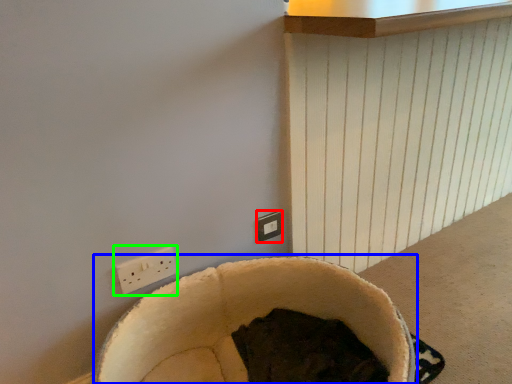
Question: Which is farther away from electric outlet (highlighted by a red box)? bean bag chair (highlighted by a blue box) or power plugs and sockets (highlighted by a green box)?

Choices:
 (A) bean bag chair
 (B) power plugs and sockets

Answer: (B)